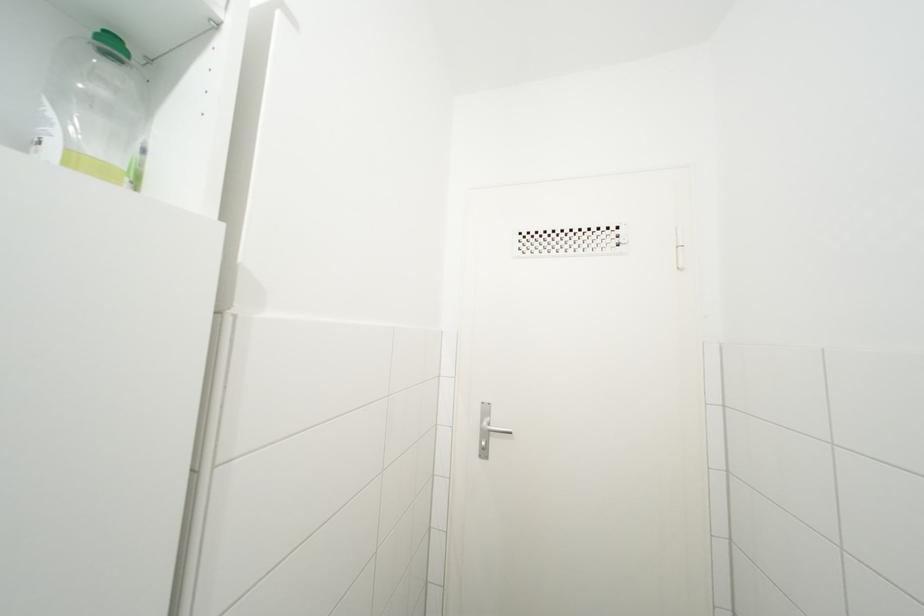
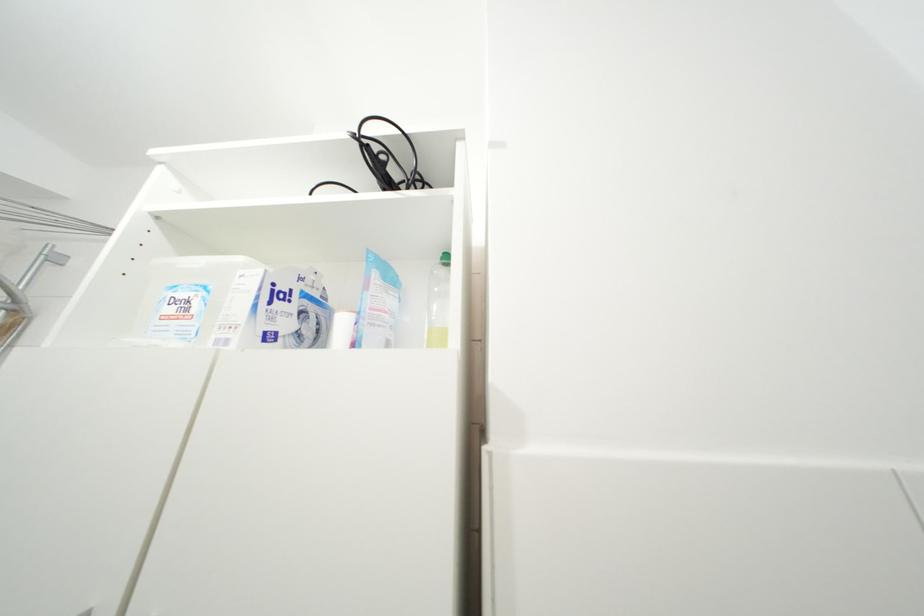
How did the camera likely rotate?

The camera rotated toward left-up.